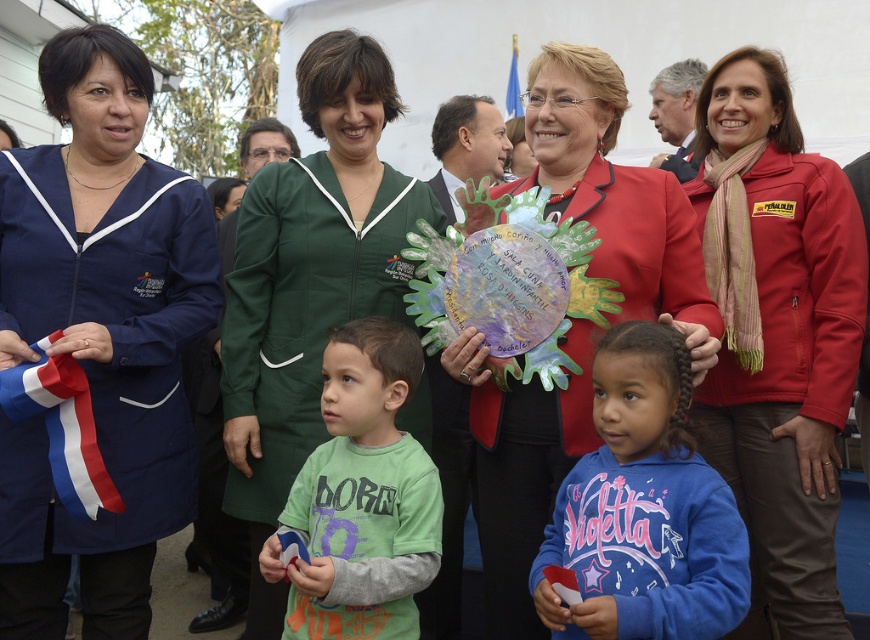
You are a photographer at the event and want to capture both the red softshell jacket at center and the blue fleece sweatshirt at center in the same frame. Which clothing item should you focus on first to ensure both are in the frame?

The red softshell jacket at center is much taller than the blue fleece sweatshirt at center, so you should focus on the red softshell jacket at center first to ensure both are in the frame.

You are organizing a charity event and need to arrange two jackets on a display rack. The rack has a limited width. Given the red softshell jacket at center and the blue fleece sweatshirt at center, which jacket requires more space horizontally?

The red softshell jacket at center requires more horizontal space because its width is larger than the blue fleece sweatshirt at center.